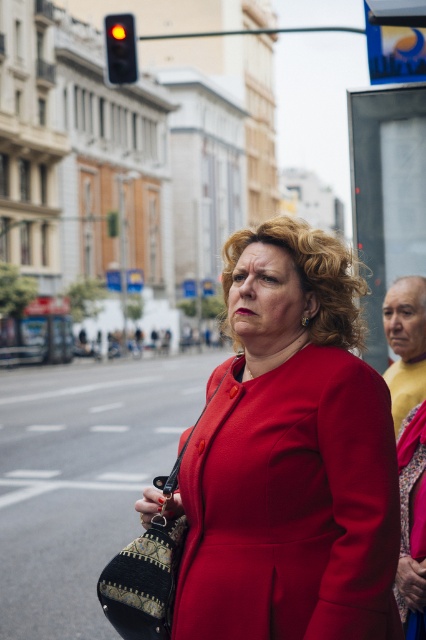
Does matte red coat at center come in front of smooth yellow shirt at right?

Yes.

Is matte red coat at center thinner than smooth yellow shirt at right?

No, matte red coat at center is not thinner than smooth yellow shirt at right.

Is point (264, 406) farther from camera compared to point (400, 280)?

No, it is in front of (400, 280).

Identify the location of matte red coat at center. This screenshot has height=640, width=426. (290, 506).

Is point (247, 426) more distant than point (411, 627)?

No, (247, 426) is in front of (411, 627).

Find the location of a particular element. The width and height of the screenshot is (426, 640). matte red coat at center is located at coordinates point(290,506).

Can you confirm if velvet red dress at center is taller than red glass traffic light at upper left?

Yes.

Which of these two, velvet red dress at center or red glass traffic light at upper left, stands shorter?

With less height is red glass traffic light at upper left.

What do you see at coordinates (411, 524) in the screenshot?
I see `velvet red dress at center` at bounding box center [411, 524].

Where is `velvet red dress at center`? velvet red dress at center is located at coordinates click(411, 524).